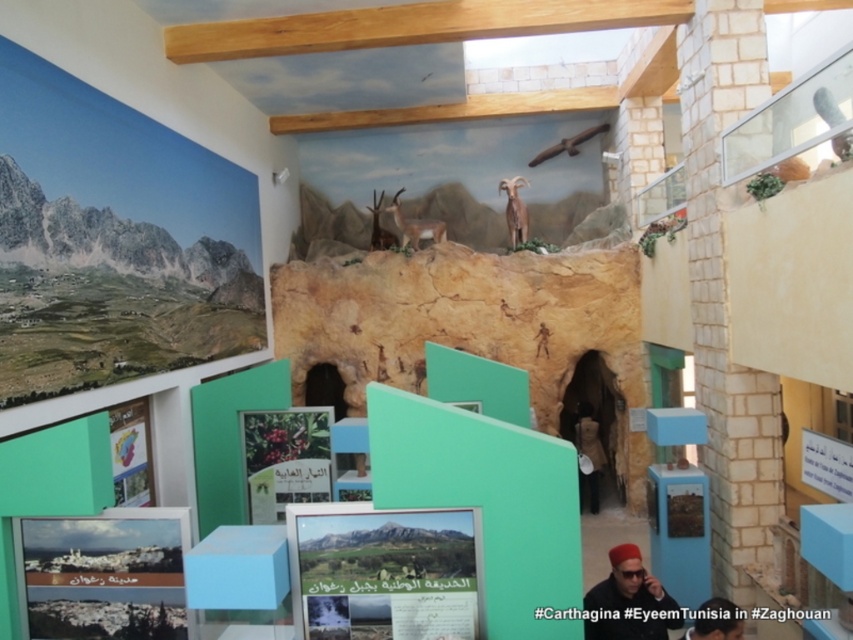
Which is in front, point (602, 595) or point (410, 227)?

Positioned in front is point (602, 595).

Is point (622, 545) closer to viewer compared to point (399, 228)?

Yes, point (622, 545) is in front of point (399, 228).

What do you see at coordinates (628, 600) in the screenshot? This screenshot has width=853, height=640. I see `matte red hat at lower right` at bounding box center [628, 600].

I want to click on matte red hat at lower right, so click(x=628, y=600).

Is matte black hat at lower right below brown textured antelope at center?

Yes.

Is matte black hat at lower right taller than brown textured antelope at center?

In fact, matte black hat at lower right may be shorter than brown textured antelope at center.

Where is `matte black hat at lower right`? This screenshot has height=640, width=853. matte black hat at lower right is located at coordinates coord(717,621).

What are the coordinates of `matte black hat at lower right` in the screenshot? It's located at (717, 621).

Does matte black hat at lower right appear on the right side of metallic silver knife at upper right?

Incorrect, matte black hat at lower right is not on the right side of metallic silver knife at upper right.

How much distance is there between matte black hat at lower right and metallic silver knife at upper right?

matte black hat at lower right and metallic silver knife at upper right are 2.76 meters apart.

Between point (689, 632) and point (838, 156), which one is positioned in front?

Point (689, 632) is more forward.

In order to click on matte black hat at lower right in this screenshot , I will do `click(717, 621)`.